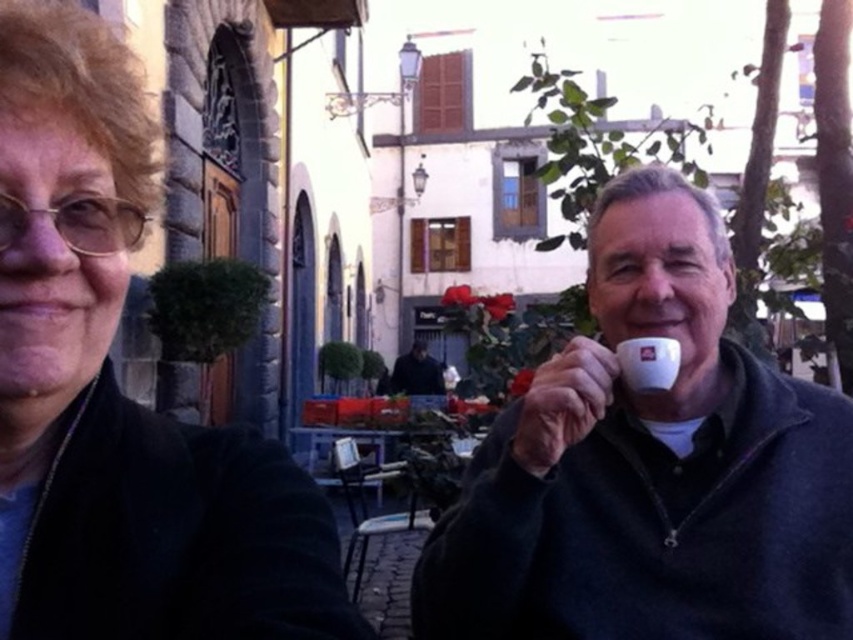
Question: From the image, what is the correct spatial relationship of white ceramic cup at right in relation to matte black jacket at left?

Choices:
 (A) left
 (B) right

Answer: (B)

Question: Is matte black jacket at left in front of dark blue sweater at center?

Choices:
 (A) no
 (B) yes

Answer: (B)

Question: Among these objects, which one is nearest to the camera?

Choices:
 (A) dark blue sweater at center
 (B) matte black jacket at left

Answer: (B)

Question: Which of the following is the closest to the observer?

Choices:
 (A) dark blue sweater at center
 (B) white matte mug at upper right

Answer: (B)

Question: Which of the following is the farthest from the observer?

Choices:
 (A) dark blue sweater at center
 (B) matte black jacket at left
 (C) white matte mug at upper right
 (D) white ceramic cup at right

Answer: (A)

Question: From the image, what is the correct spatial relationship of matte black jacket at left in relation to dark blue sweater at center?

Choices:
 (A) above
 (B) below

Answer: (A)